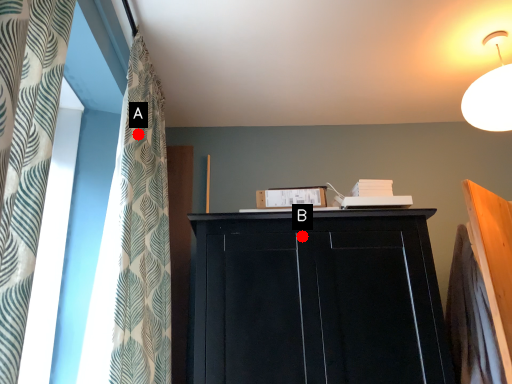
Question: Two points are circled on the image, labeled by A and B beside each circle. Which point appears closest to the camera in this image?

Choices:
 (A) A is closer
 (B) B is closer

Answer: (B)